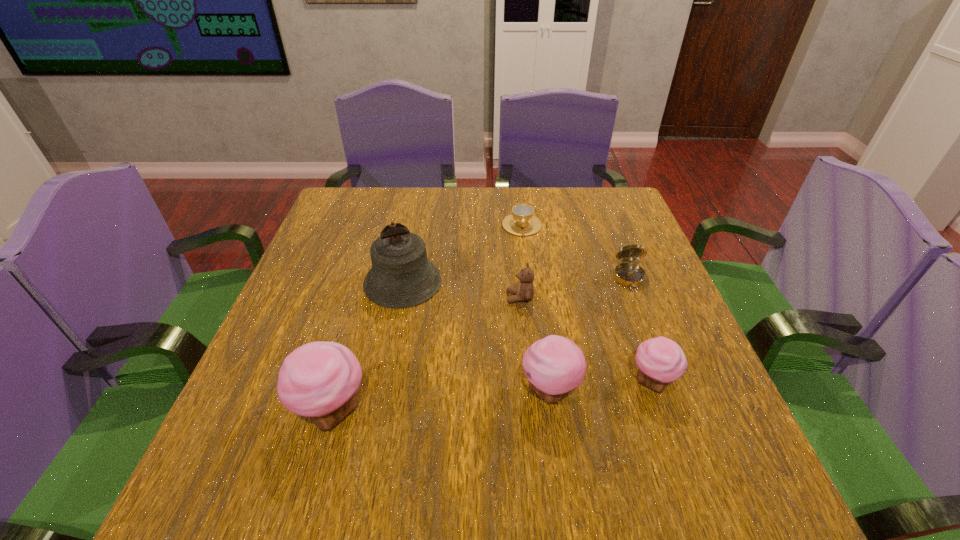
Where is `vacant area situated 0.240m on the back of the tallest cupcake`? vacant area situated 0.240m on the back of the tallest cupcake is located at coordinates (366, 295).

Where is `vacant space located on the right of the second cupcake from right to left`? Image resolution: width=960 pixels, height=540 pixels. vacant space located on the right of the second cupcake from right to left is located at coordinates (633, 391).

Where is `vacant region located 0.380m on the back of the shortest cupcake`? This screenshot has height=540, width=960. vacant region located 0.380m on the back of the shortest cupcake is located at coordinates (605, 247).

Where is `vacant space located 0.130m with the handle on the side of the shortest object`? The image size is (960, 540). vacant space located 0.130m with the handle on the side of the shortest object is located at coordinates (527, 267).

Find the location of a particular element. vacant space situated on the left of the bell is located at coordinates (335, 282).

Locate an element on the screen. This screenshot has width=960, height=540. free spot located 0.170m with the dial facing the compass is located at coordinates (656, 348).

Locate an element on the screen. vacant position located on the front-facing side of the teddy bear is located at coordinates (338, 298).

The height and width of the screenshot is (540, 960). In order to click on vacant space situated 0.350m on the front-facing side of the teddy bear in this screenshot , I will do `click(355, 298)`.

Find the location of a particular element. The width and height of the screenshot is (960, 540). free point located on the front-facing side of the teddy bear is located at coordinates (368, 298).

Where is `object at the far edge`? object at the far edge is located at coordinates (521, 222).